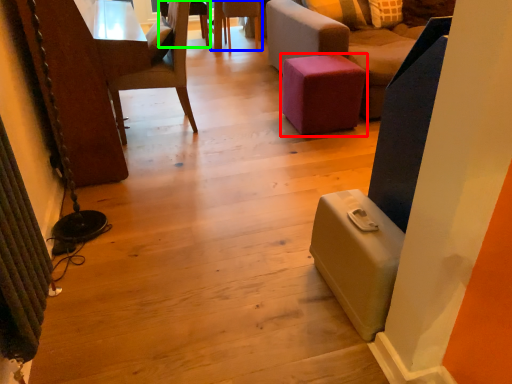
Question: Which object is positioned closest to furniture (highlighted by a red box)? Select from chair (highlighted by a blue box) and chair (highlighted by a green box).

Choices:
 (A) chair
 (B) chair

Answer: (A)